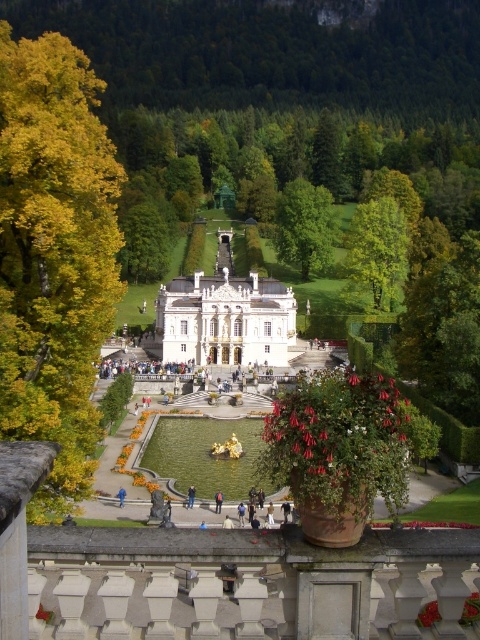
You are standing at the base of the palace staircase and want to take a photo of both the green leafy tree at upper center and the green leafy tree at center. Which tree should you focus on first to ensure both are in the frame?

You should focus on the green leafy tree at center first because it is larger and closer to your position, ensuring both trees remain in the frame.

You are standing at the base of the palace stairs and see both the blue jeans at lower center and the blue fabric person at center. Which object is closer to you?

The blue jeans at lower center is closer to you because the blue fabric person at center is behind it.

You are a visitor standing at the base of the palace staircase. You see the green leafy tree at upper center and the blue fabric jacket at center. Which object is closer to you?

The green leafy tree at upper center is closer to you because the blue fabric jacket at center is behind it.